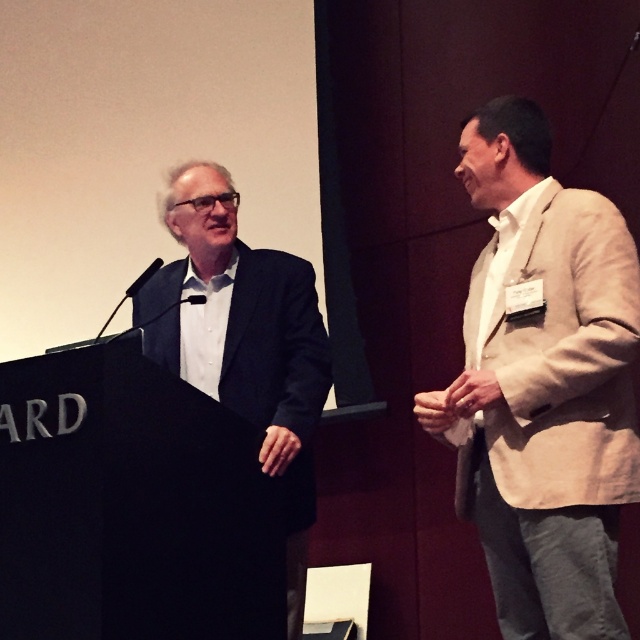
You are a photographer at the event and need to capture a photo where both the beige textured blazer at right and the dark blue suit at left are clearly visible. Based on their positions, which one should you focus on first to ensure both are in frame?

The beige textured blazer at right is above the dark blue suit at left, so focusing on the beige textured blazer at right first will ensure both are in frame as the dark blue suit at left is below it.